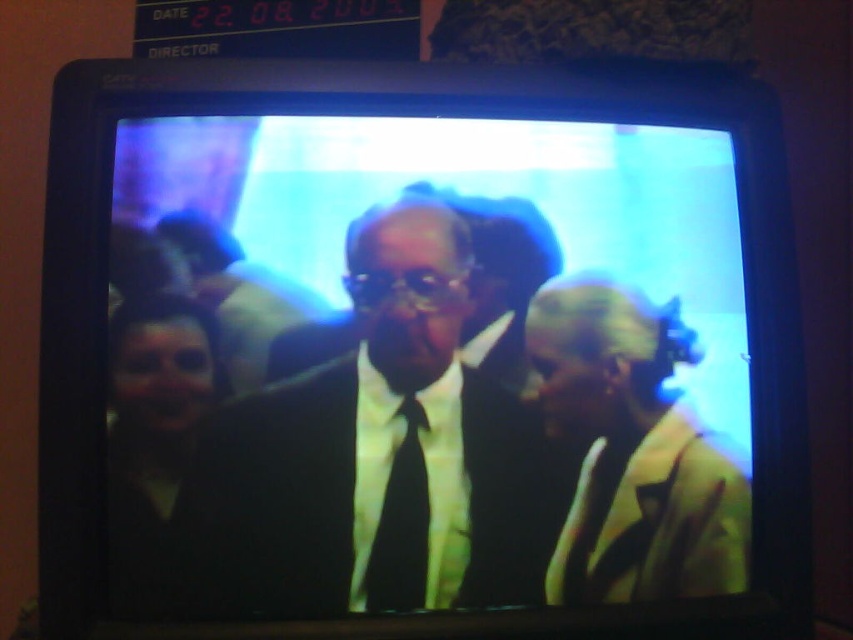
You are a photographer setting up for a photoshoot. You need to place a light source between the matte yellow jacket at right and the black silk tie at center so that it illuminates both objects equally. Based on their positions, where should you place the light source?

The matte yellow jacket at right is further to the viewer than the black silk tie at center. To illuminate both equally, place the light source at a position equidistant from both objects, slightly closer to the black silk tie at center to compensate for the difference in depth.

You are standing in front of the TV screen and notice two points marked on the screen. The first point is at coordinates point [431,472] and the second is at point [422,522]. Which point is closer to the camera?

Point [422,522] is closer to the camera because it is in front of point [431,472] according to their spatial arrangement.